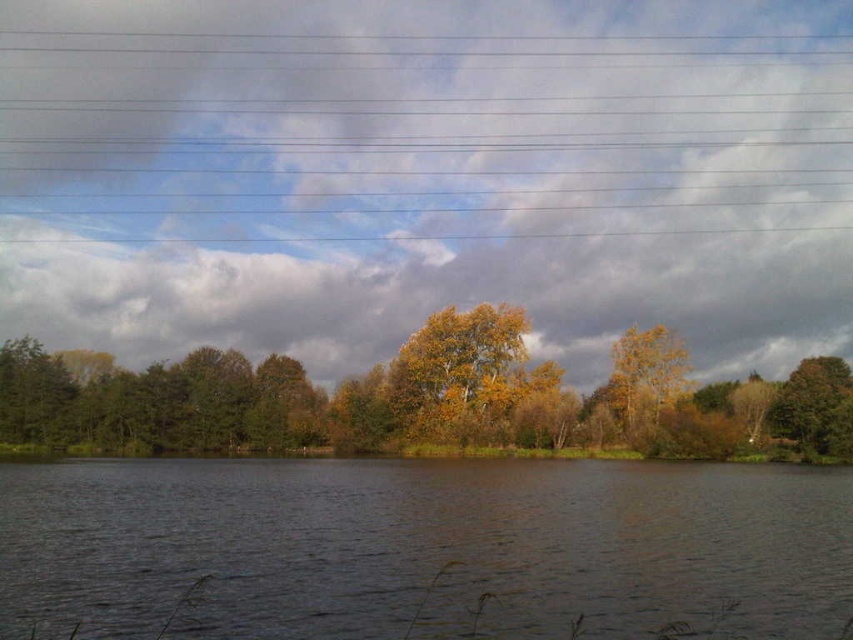
You are standing at the edge of the lake and want to take a photo. There are two points in the scene labeled as point 1 at coordinates point (726, 442) and point 2 at coordinates point (498, 376). Which point will appear larger in your photo?

Point (726, 442) is closer to the camera than point (498, 376), so it will appear larger in the photo.